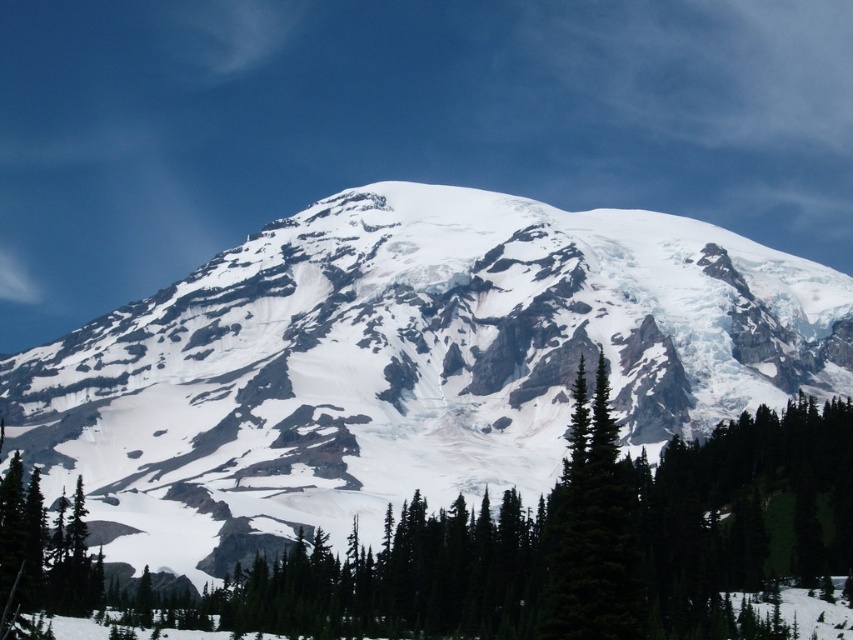
Question: Can you confirm if white snow-covered mountain at center is wider than green matte tree at center?

Choices:
 (A) yes
 (B) no

Answer: (A)

Question: Does white snow-covered mountain at center appear over green matte tree at center?

Choices:
 (A) yes
 (B) no

Answer: (A)

Question: Which point is farther to the camera?

Choices:
 (A) green matte tree at center
 (B) white snow-covered mountain at center

Answer: (B)

Question: Can you confirm if white snow-covered mountain at center is positioned to the left of green matte tree at center?

Choices:
 (A) yes
 (B) no

Answer: (A)